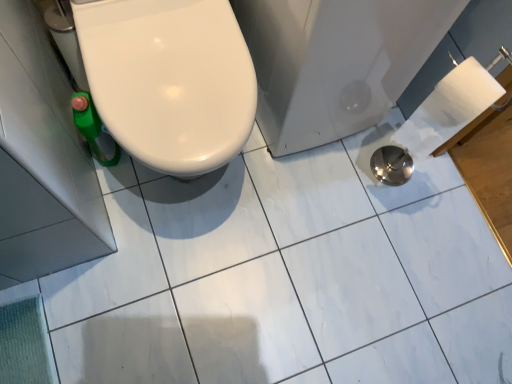
Question: Is metallic silver bath at lower right wider or thinner than white glossy toilet at left?

Choices:
 (A) wide
 (B) thin

Answer: (A)

Question: Is point (421, 31) positioned closer to the camera than point (116, 130)?

Choices:
 (A) closer
 (B) farther

Answer: (B)

Question: From the image's perspective, relative to white glossy toilet at left, is metallic silver bath at lower right above or below?

Choices:
 (A) below
 (B) above

Answer: (B)

Question: Visually, is white glossy toilet at left positioned to the left or to the right of metallic silver bath at lower right?

Choices:
 (A) left
 (B) right

Answer: (A)

Question: Would you say white glossy toilet at left is inside or outside metallic silver bath at lower right?

Choices:
 (A) outside
 (B) inside

Answer: (A)

Question: From the image's perspective, is white glossy toilet at left above or below metallic silver bath at lower right?

Choices:
 (A) below
 (B) above

Answer: (A)

Question: In terms of size, does white glossy toilet at left appear bigger or smaller than metallic silver bath at lower right?

Choices:
 (A) big
 (B) small

Answer: (B)